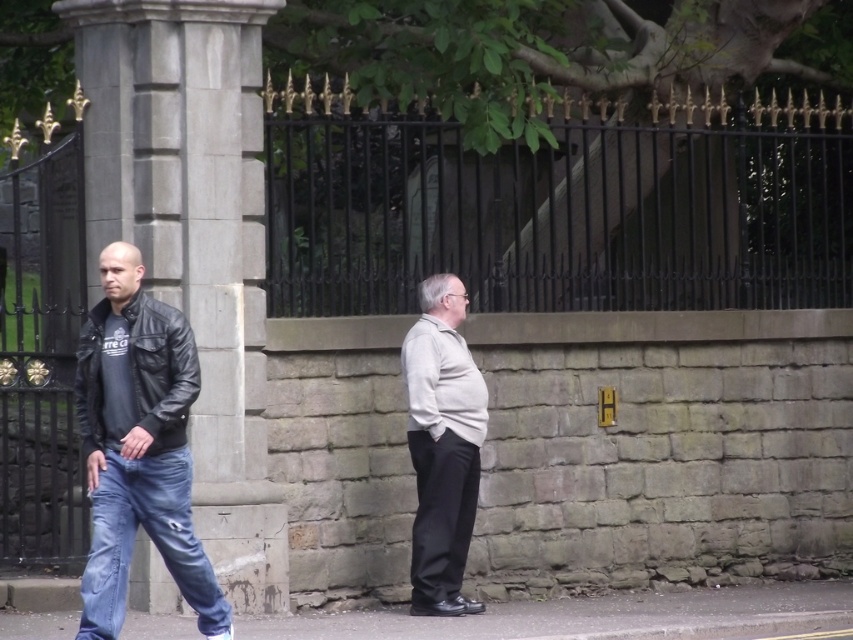
Question: Which object is farther from the camera taking this photo?

Choices:
 (A) light gray sweater at center
 (B) leather jacket at left
 (C) gray asphalt at lower center

Answer: (A)

Question: Estimate the real-world distances between objects in this image. Which object is closer to the light gray sweater at center?

Choices:
 (A) light beige sweater at center
 (B) gray asphalt at lower center

Answer: (A)

Question: Can you confirm if light beige sweater at center is positioned below denim jeans at left?

Choices:
 (A) yes
 (B) no

Answer: (B)

Question: Observing the image, what is the correct spatial positioning of gray asphalt at lower center in reference to light gray sweater at center?

Choices:
 (A) below
 (B) above

Answer: (A)

Question: Which point appears closest to the camera in this image?

Choices:
 (A) (466, 496)
 (B) (434, 378)
 (C) (39, 628)
 (D) (171, 232)

Answer: (C)

Question: Does gray stone pillar at center lie behind leather jacket at left?

Choices:
 (A) no
 (B) yes

Answer: (B)